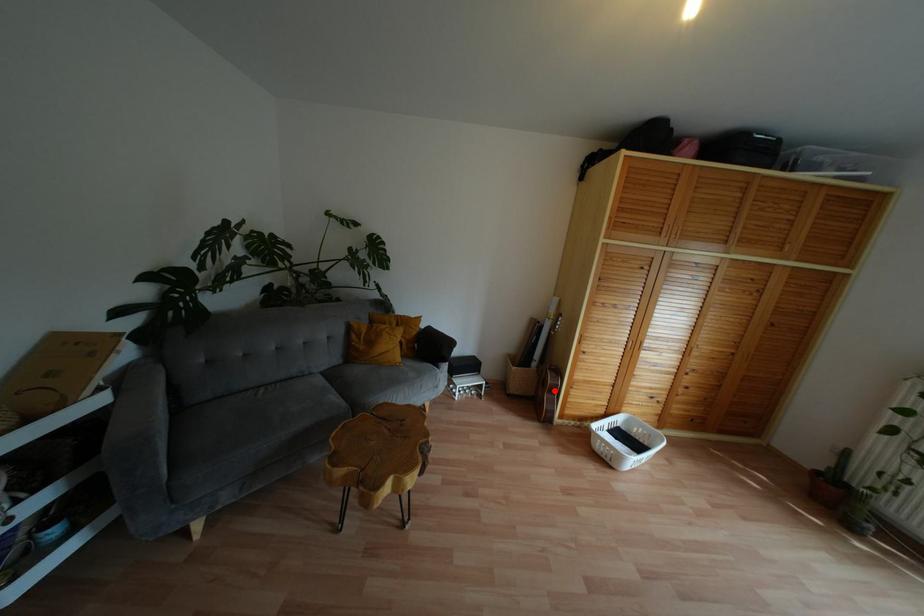
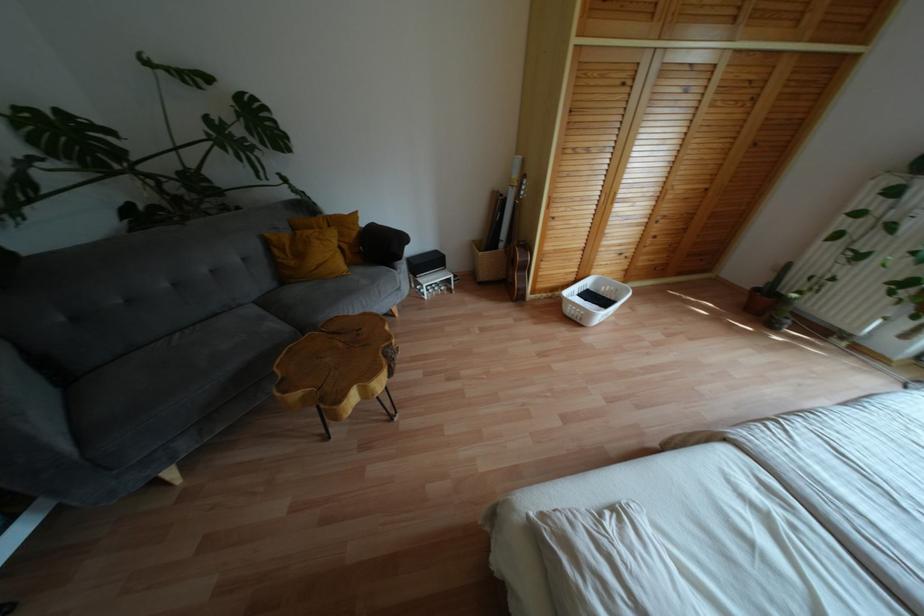
Locate, in the second image, the point that corresponds to the highlighted location in the first image.

(525, 267)